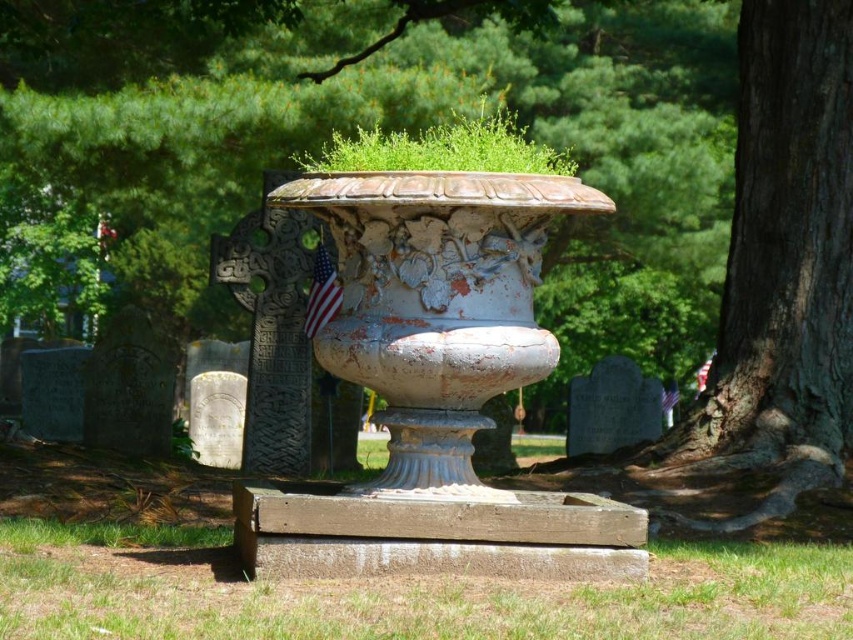
Question: Among these points, which one is nearest to the camera?

Choices:
 (A) (13, 556)
 (B) (416, 392)
 (C) (717, 273)

Answer: (B)

Question: Is smooth gray bark at center right above american flag at center?

Choices:
 (A) no
 (B) yes

Answer: (B)

Question: Which object is the closest to the smooth gray bark at center right?

Choices:
 (A) green grass at lower center
 (B) american flag at center
 (C) distressed white vase at center

Answer: (B)

Question: Can you confirm if smooth gray bark at center right is positioned below green grass at lower center?

Choices:
 (A) yes
 (B) no

Answer: (B)

Question: Which of the following is the closest to the observer?

Choices:
 (A) (321, 321)
 (B) (300, 593)
 (C) (436, 250)

Answer: (B)

Question: Can you confirm if smooth gray bark at center right is thinner than green grass at lower center?

Choices:
 (A) yes
 (B) no

Answer: (B)